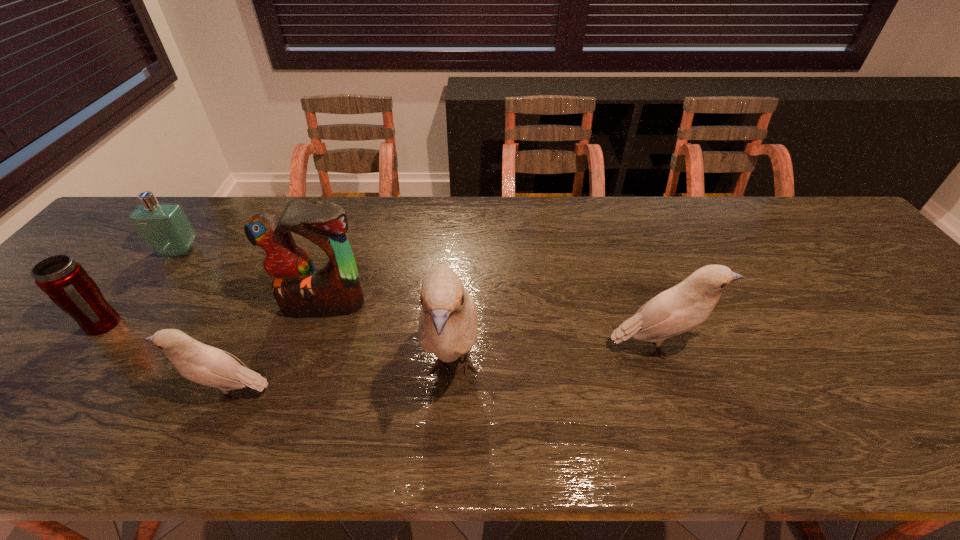
Choose which object is the fifth nearest neighbor to the rightmost bird. Please provide its 2D coordinates. Your answer should be formatted as a tuple, i.e. [(x, y)], where the tuple contains the x and y coordinates of a point satisfying the conditions above.

[(64, 280)]

I want to click on object that is the fifth nearest to the leftmost bird, so click(x=685, y=306).

Identify which bird is the second nearest to the second tallest bird. Please provide its 2D coordinates. Your answer should be formatted as a tuple, i.e. [(x, y)], where the tuple contains the x and y coordinates of a point satisfying the conditions above.

[(203, 364)]

This screenshot has height=540, width=960. In order to click on bird that stands as the third closest to the perfume in this screenshot , I will do `click(685, 306)`.

Locate an element on the screen. vacant space that satisfies the following two spatial constraints: 1. at the beak of the second shortest bird; 2. at the beak of the second bird from right to left is located at coordinates (664, 369).

Locate an element on the screen. free location that satisfies the following two spatial constraints: 1. at the beak of the second tallest bird; 2. at the beak of the second object from right to left is located at coordinates (664, 369).

You are a GUI agent. You are given a task and a screenshot of the screen. Output one action in this format:
    pyautogui.click(x=<x>, y=<y>)
    Task: Click on the free region that satisfies the following two spatial constraints: 1. on the front label of the perfume; 2. on the side with the handle of the thermos bottle
    The image size is (960, 540).
    Given the screenshot: What is the action you would take?
    (x=124, y=325)